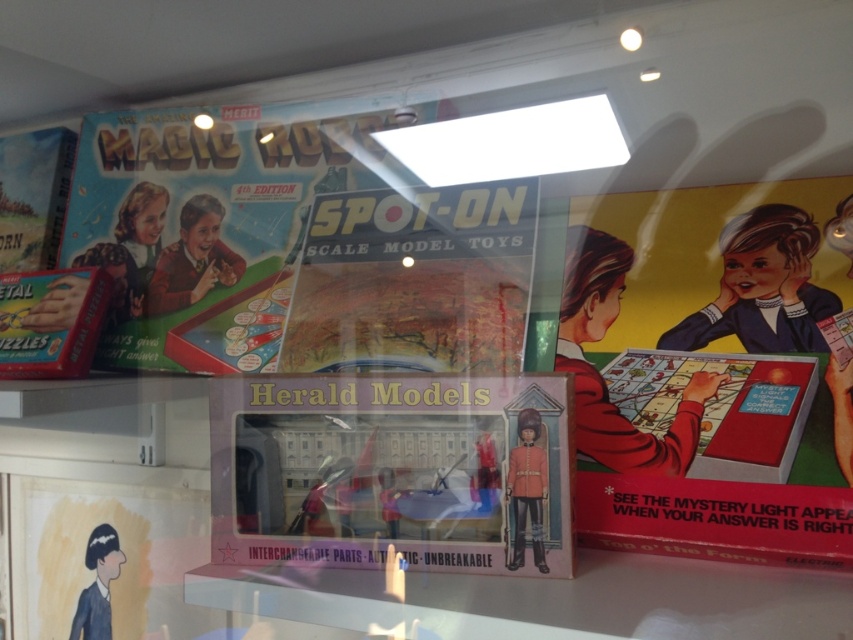
Question: Can you confirm if matte cardboard game at upper left is smaller than matte red uniform at center?

Choices:
 (A) no
 (B) yes

Answer: (A)

Question: Which point is farther to the camera?

Choices:
 (A) matte red board game at center
 (B) metallic puzzles at left
 (C) matte black toy soldier at lower left

Answer: (C)

Question: Estimate the real-world distances between objects in this image. Which object is farther from the metallic puzzles at left?

Choices:
 (A) matte black toy soldier at lower left
 (B) matte plastic toy set at center

Answer: (B)

Question: Based on their relative distances, which object is farther from the metallic puzzles at left?

Choices:
 (A) white fluorescent light at center
 (B) matte cardboard game at upper left

Answer: (A)

Question: Observing the image, what is the correct spatial positioning of matte cardboard game at upper left in reference to matte red board game at center?

Choices:
 (A) right
 (B) left

Answer: (B)

Question: Can you confirm if matte red board game at center is smaller than white fluorescent light at center?

Choices:
 (A) yes
 (B) no

Answer: (A)